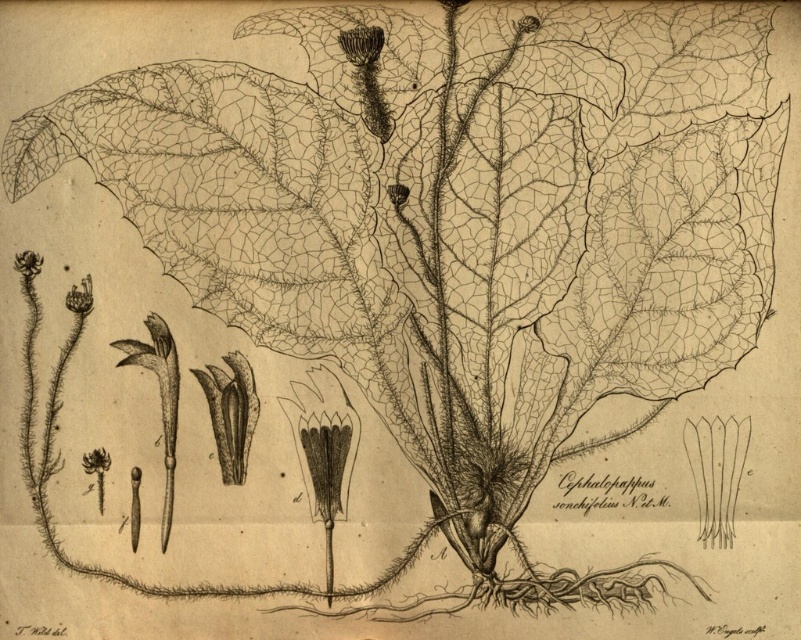
Question: Is matte black flower at upper left wider than white paper flower at upper left?

Choices:
 (A) no
 (B) yes

Answer: (B)

Question: From the image, what is the correct spatial relationship of matte black flower at upper left in relation to white paper flower at upper left?

Choices:
 (A) left
 (B) right

Answer: (B)

Question: Which of the following is the closest to the observer?

Choices:
 (A) (83, 307)
 (B) (29, 260)

Answer: (B)

Question: Which of the following is the closest to the observer?

Choices:
 (A) (71, 296)
 (B) (21, 260)

Answer: (B)

Question: Does matte black flower at upper left come in front of white paper flower at upper left?

Choices:
 (A) no
 (B) yes

Answer: (A)